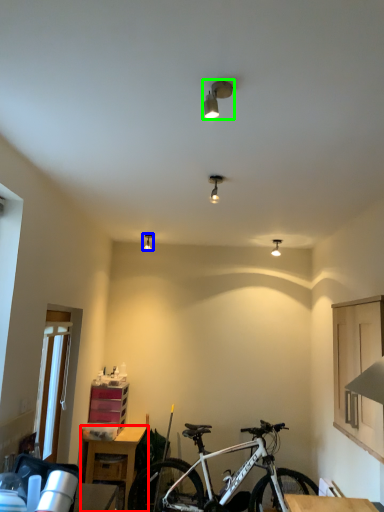
Question: Considering the real-world distances, which object is farthest from table (highlighted by a red box)? light fixture (highlighted by a blue box) or light fixture (highlighted by a green box)?

Choices:
 (A) light fixture
 (B) light fixture

Answer: (B)